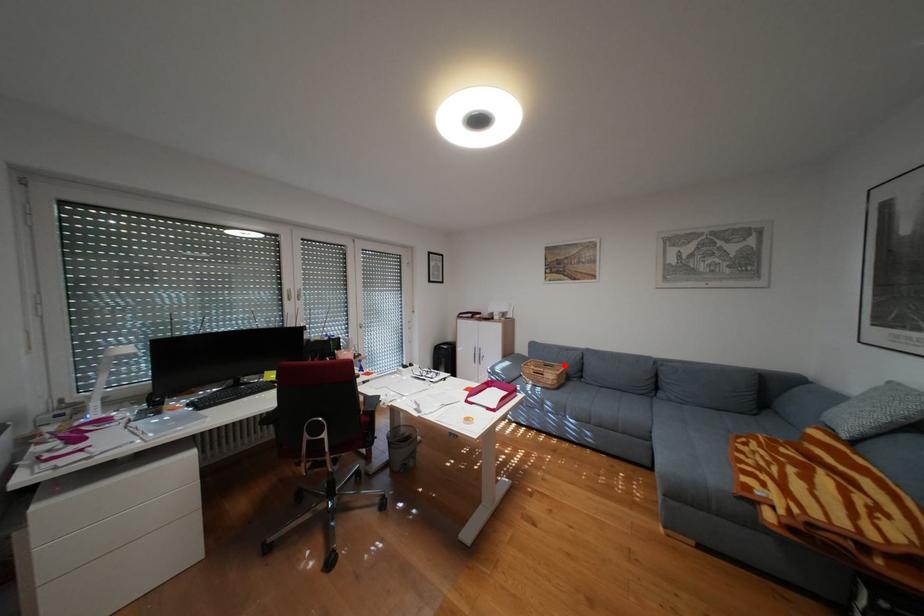
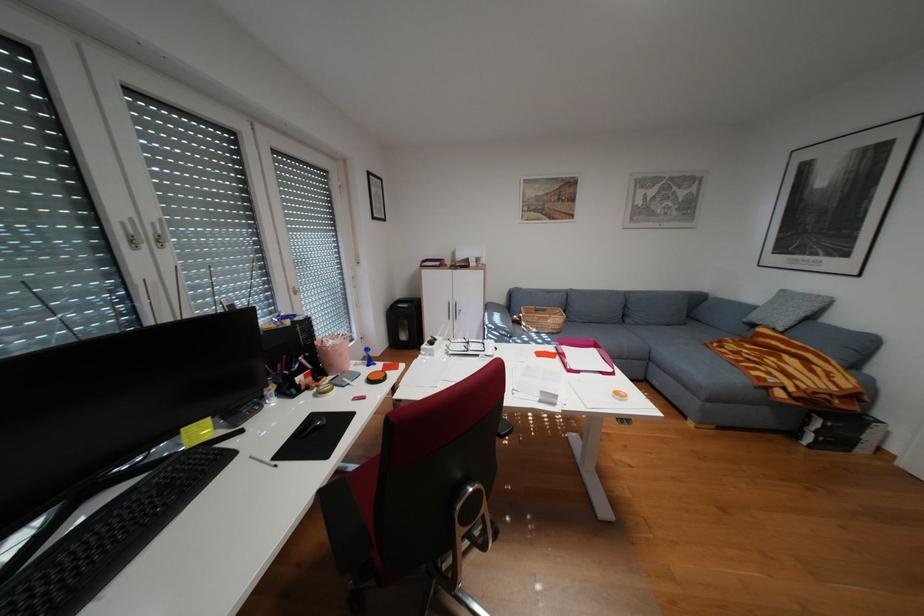
Question: I am providing you with two images of the same scene from different viewpoints. A red point is shown in image1. For the corresponding object point in image2, is it positioned nearer or farther from the camera?

Choices:
 (A) Nearer
 (B) Farther

Answer: (A)